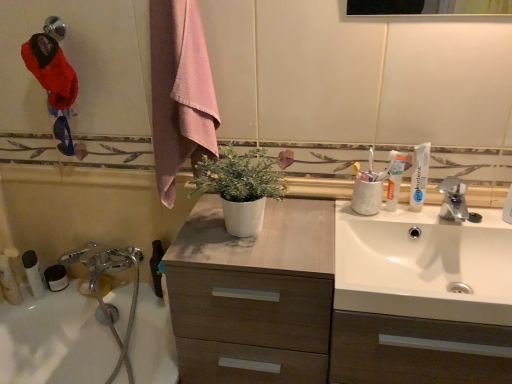
The height and width of the screenshot is (384, 512). I want to click on vacant area situated below white matte pot at center (from a real-world perspective), so click(246, 239).